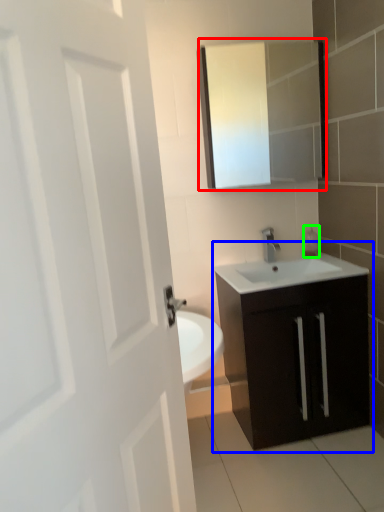
Question: Which is farther away from medicine cabinet (highlighted by a red box)? bathroom cabinet (highlighted by a blue box) or soap dispenser (highlighted by a green box)?

Choices:
 (A) bathroom cabinet
 (B) soap dispenser

Answer: (A)